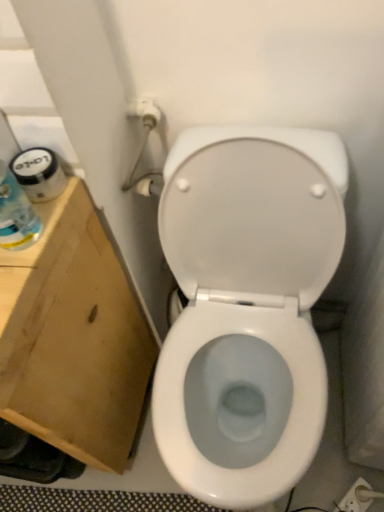
Question: Is translucent plastic bottle at left directly adjacent to brown cardboard at left?

Choices:
 (A) no
 (B) yes

Answer: (A)

Question: Is brown cardboard at left at the back of translucent plastic bottle at left?

Choices:
 (A) yes
 (B) no

Answer: (B)

Question: Is translucent plastic bottle at left at the right side of brown cardboard at left?

Choices:
 (A) no
 (B) yes

Answer: (B)

Question: Are translucent plastic bottle at left and brown cardboard at left located far from each other?

Choices:
 (A) no
 (B) yes

Answer: (A)

Question: Is translucent plastic bottle at left bigger than brown cardboard at left?

Choices:
 (A) no
 (B) yes

Answer: (A)

Question: From their relative heights in the image, would you say white glossy toilet at center is taller or shorter than translucent plastic bottle at left?

Choices:
 (A) tall
 (B) short

Answer: (A)

Question: Do you think white glossy toilet at center is within translucent plastic bottle at left, or outside of it?

Choices:
 (A) inside
 (B) outside

Answer: (B)

Question: Considering the positions of white glossy toilet at center and translucent plastic bottle at left in the image, is white glossy toilet at center bigger or smaller than translucent plastic bottle at left?

Choices:
 (A) big
 (B) small

Answer: (A)

Question: Would you say white glossy toilet at center is to the left or to the right of translucent plastic bottle at left in the picture?

Choices:
 (A) left
 (B) right

Answer: (B)

Question: Which is correct: white plastic electric outlet at lower right is inside white glossy toilet at center, or outside of it?

Choices:
 (A) outside
 (B) inside

Answer: (A)

Question: From the image's perspective, is white plastic electric outlet at lower right positioned above or below white glossy toilet at center?

Choices:
 (A) above
 (B) below

Answer: (B)

Question: Relative to white glossy toilet at center, is white plastic electric outlet at lower right in front or behind?

Choices:
 (A) behind
 (B) front

Answer: (A)

Question: In terms of width, does white plastic electric outlet at lower right look wider or thinner when compared to white glossy toilet at center?

Choices:
 (A) wide
 (B) thin

Answer: (B)

Question: In terms of height, does brown cardboard at left look taller or shorter compared to white plastic electric outlet at lower right?

Choices:
 (A) short
 (B) tall

Answer: (B)

Question: Based on their sizes in the image, would you say brown cardboard at left is bigger or smaller than white plastic electric outlet at lower right?

Choices:
 (A) big
 (B) small

Answer: (A)